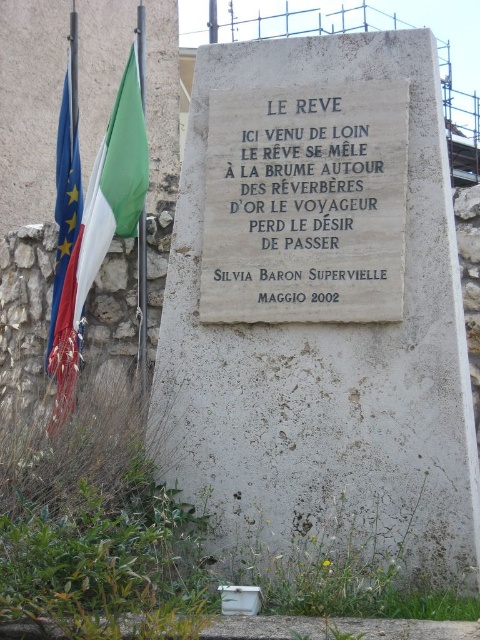
Can you confirm if green fabric flag at left is taller than european union flag at left?

No, green fabric flag at left is not taller than european union flag at left.

Does green fabric flag at left have a lesser height compared to european union flag at left?

Yes.

Between point (87, 259) and point (54, 321), which one is positioned behind?

The point (54, 321) is behind.

You are a GUI agent. You are given a task and a screenshot of the screen. Output one action in this format:
    pyautogui.click(x=<x>, y=<y>)
    Task: Click on the green fabric flag at left
    The height and width of the screenshot is (640, 480).
    Given the screenshot: What is the action you would take?
    pyautogui.click(x=113, y=182)

Who is positioned more to the right, black stone plaque at center or european union flag at left?

black stone plaque at center is more to the right.

Does black stone plaque at center have a lesser height compared to european union flag at left?

Correct, black stone plaque at center is not as tall as european union flag at left.

Measure the distance between point (369, 237) and camera.

Point (369, 237) and camera are 14.00 meters apart.

This screenshot has height=640, width=480. In order to click on black stone plaque at center in this screenshot , I will do `click(303, 205)`.

Describe the element at coordinates (303, 205) in the screenshot. I see `black stone plaque at center` at that location.

Who is shorter, black stone plaque at center or green fabric flag at left?

green fabric flag at left

Locate an element on the screen. black stone plaque at center is located at coordinates (303, 205).

The image size is (480, 640). Find the location of `black stone plaque at center`. black stone plaque at center is located at coordinates (303, 205).